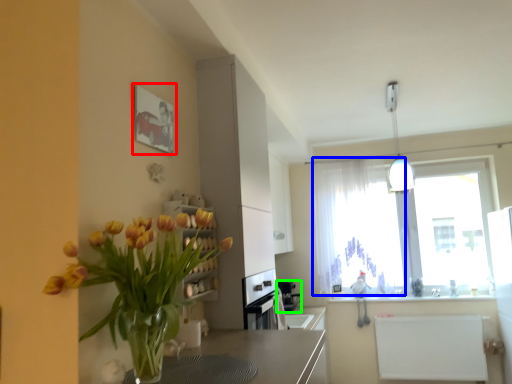
Question: Considering the real-world distances, which object is farthest from picture frame (highlighted by a red box)? curtain (highlighted by a blue box) or appliance (highlighted by a green box)?

Choices:
 (A) curtain
 (B) appliance

Answer: (B)